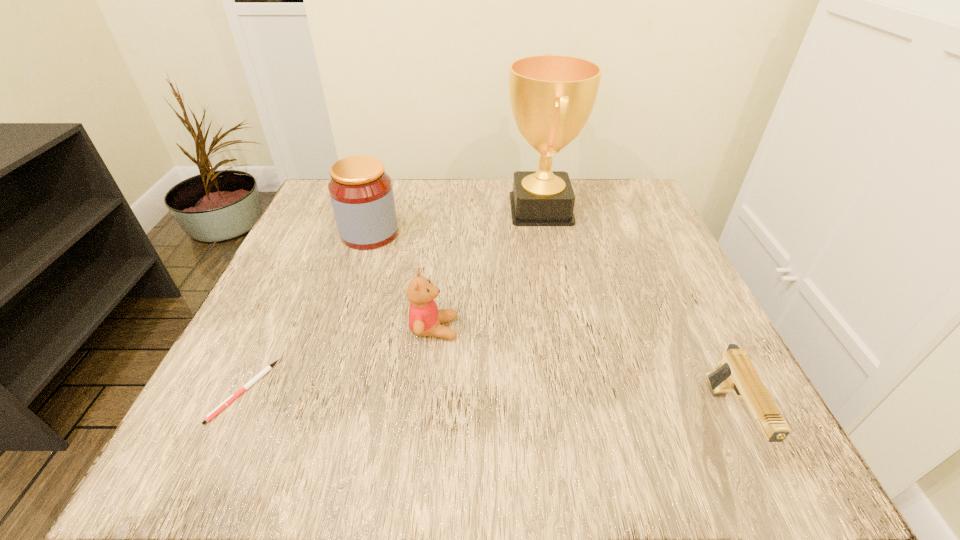
Locate an element on the screen. vacant space at the far right corner of the desktop is located at coordinates (652, 211).

Locate an element on the screen. Image resolution: width=960 pixels, height=540 pixels. free area in between the fourth tallest object and the fourth shortest object is located at coordinates (550, 327).

This screenshot has height=540, width=960. Identify the location of vacant space in between the third nearest object and the jar. (402, 281).

Locate an element on the screen. Image resolution: width=960 pixels, height=540 pixels. blank region between the third object from left to right and the leftmost object is located at coordinates (339, 360).

The height and width of the screenshot is (540, 960). I want to click on empty space between the jar and the rightmost object, so click(x=550, y=327).

Locate an element on the screen. vacant space in between the pen and the third farthest object is located at coordinates (339, 360).

Where is `free space between the pen and the pistol`? free space between the pen and the pistol is located at coordinates (487, 405).

What are the coordinates of `free space between the pistol and the third object from right to left` in the screenshot? It's located at (582, 374).

Where is `empty location between the rightmost object and the pen`? The width and height of the screenshot is (960, 540). empty location between the rightmost object and the pen is located at coordinates (487, 405).

The width and height of the screenshot is (960, 540). In order to click on free space between the shortest object and the fourth tallest object in this screenshot , I will do `click(487, 405)`.